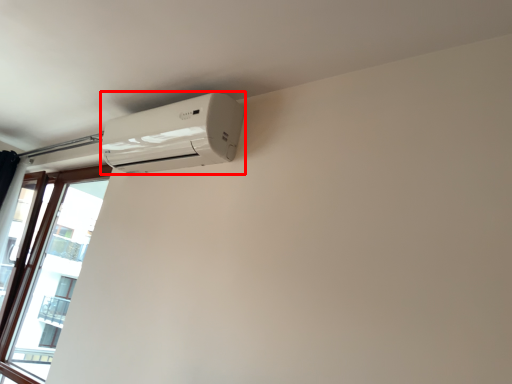
Question: Where is home appliance (annotated by the red box) located in relation to window in the image?

Choices:
 (A) right
 (B) left

Answer: (A)